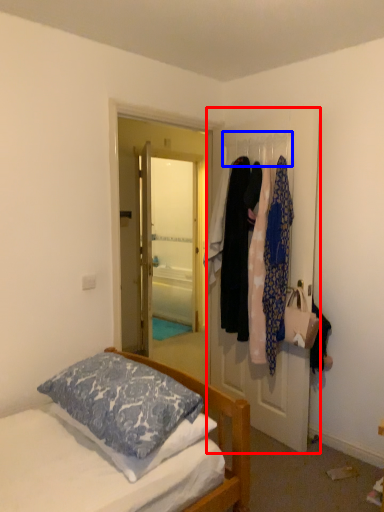
Question: Which object appears closest to the camera in this image, door (highlighted by a red box) or clothesline (highlighted by a blue box)?

Choices:
 (A) door
 (B) clothesline

Answer: (A)